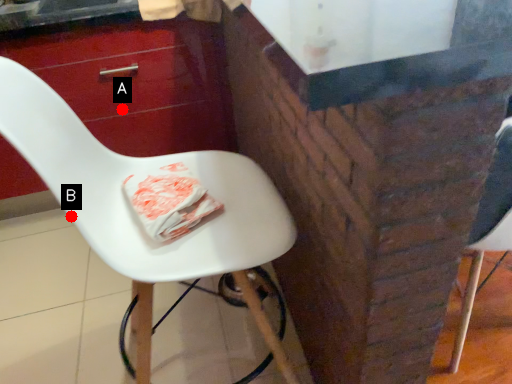
Question: Two points are circled on the image, labeled by A and B beside each circle. Among these points, which one is nearest to the camera?

Choices:
 (A) A is closer
 (B) B is closer

Answer: (B)